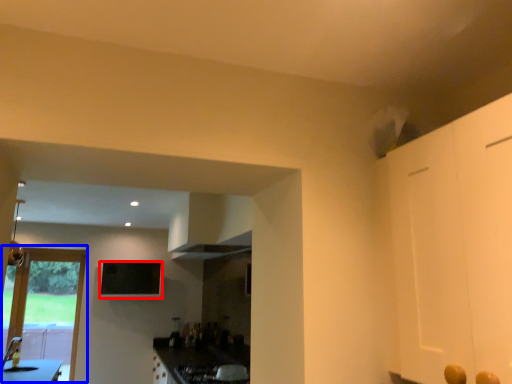
Question: Which of the following is the farthest to the observer, window screen (highlighted by a red box) or door (highlighted by a blue box)?

Choices:
 (A) window screen
 (B) door

Answer: (A)